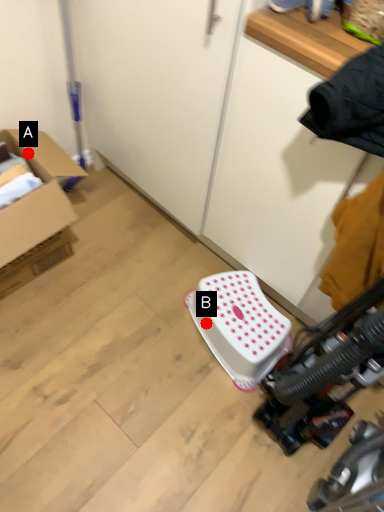
Question: Two points are circled on the image, labeled by A and B beside each circle. Which point is farther to the camera?

Choices:
 (A) A is further
 (B) B is further

Answer: (B)